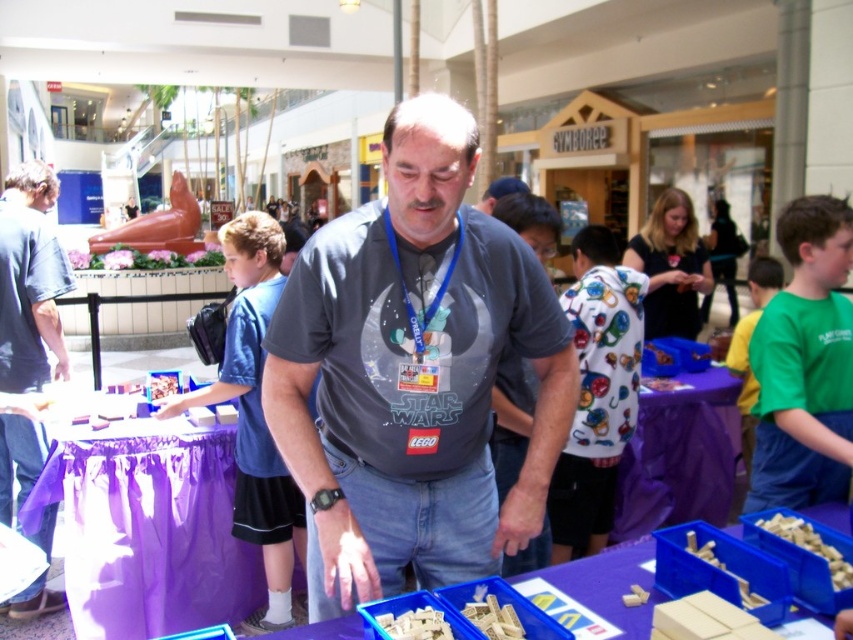
Question: Is green cotton shirt at center to the left of smooth plastic blocks at lower center from the viewer's perspective?

Choices:
 (A) yes
 (B) no

Answer: (B)

Question: Is the position of gray matte shirt at center less distant than that of white matte foam at lower center?

Choices:
 (A) yes
 (B) no

Answer: (A)

Question: Observing the image, what is the correct spatial positioning of dark blue t-shirt at left in reference to matte plastic toy at center?

Choices:
 (A) below
 (B) above

Answer: (B)

Question: Which object is positioned farthest from the wooden blocks at lower center?

Choices:
 (A) matte plastic toy at center
 (B) smooth plastic blocks at lower center
 (C) green cotton shirt at center
 (D) white matte foam at lower center

Answer: (A)

Question: Estimate the real-world distances between objects in this image. Which object is farther from the blue plastic bins at center?

Choices:
 (A) smooth plastic blocks at lower center
 (B) gray matte shirt at center

Answer: (B)

Question: Which point is closer to the camera taking this photo?

Choices:
 (A) (132, 534)
 (B) (793, 518)

Answer: (B)